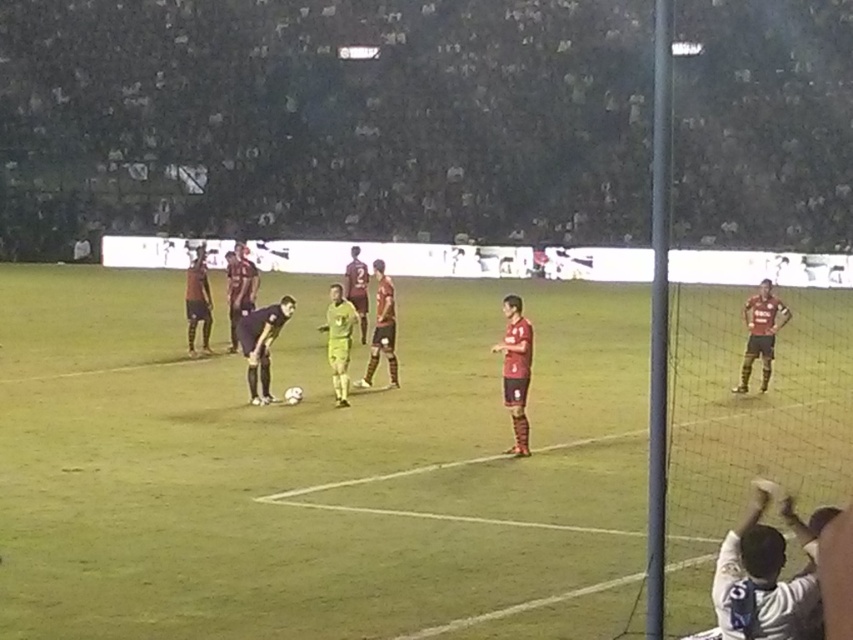
Question: Does green grass field at center appear on the left side of maroon jersey at center?

Choices:
 (A) yes
 (B) no

Answer: (B)

Question: Is matte red jersey at center positioned at the back of green matte jersey at center?

Choices:
 (A) yes
 (B) no

Answer: (B)

Question: Observing the image, what is the correct spatial positioning of green matte jersey at center in reference to maroon jersey at center?

Choices:
 (A) above
 (B) below

Answer: (A)

Question: Which of these objects is positioned closest to the green matte jersey at center?

Choices:
 (A) matte red jersey at center
 (B) dark purple jersey at center
 (C) maroon jersey at right

Answer: (B)

Question: Which point is farther to the camera?

Choices:
 (A) (509, 356)
 (B) (355, 259)
 (C) (747, 336)

Answer: (B)

Question: Which point is closer to the camera?

Choices:
 (A) green matte jersey at center
 (B) green grass field at center
 (C) maroon jersey at center

Answer: (B)